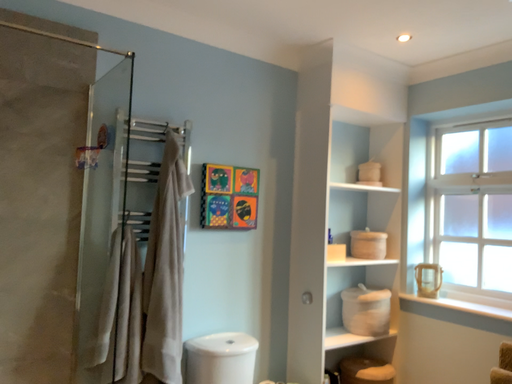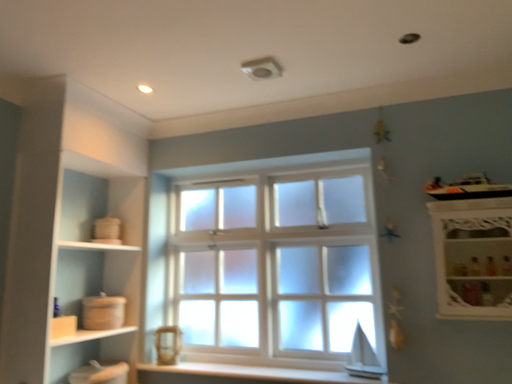
Question: How did the camera likely rotate when shooting the video?

Choices:
 (A) rotated right
 (B) rotated left

Answer: (A)